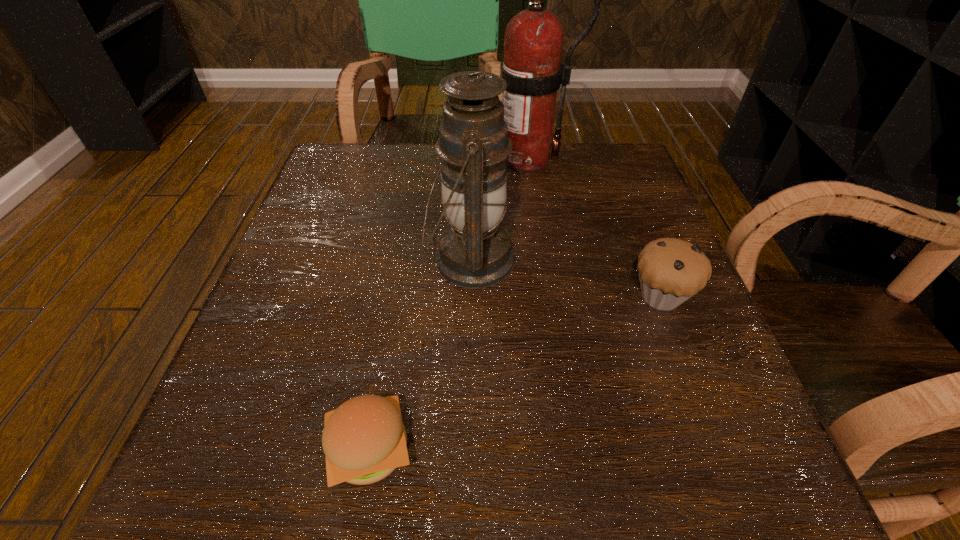
At what (x,y) coordinates should I click in order to perform the action: click on the farthest object. Please return your answer as a coordinate pair (x, y). The height and width of the screenshot is (540, 960). Looking at the image, I should click on (531, 66).

Locate an element on the screen. This screenshot has width=960, height=540. fire extinguisher is located at coordinates (531, 66).

This screenshot has height=540, width=960. I want to click on the second tallest object, so click(474, 252).

At what (x,y) coordinates should I click in order to perform the action: click on the rightmost object. Please return your answer as a coordinate pair (x, y). Looking at the image, I should click on [671, 270].

This screenshot has height=540, width=960. What are the coordinates of `muffin` in the screenshot? It's located at (671, 270).

I want to click on the shortest object, so pyautogui.click(x=364, y=440).

At what (x,y) coordinates should I click in order to perform the action: click on the nearest object. Please return your answer as a coordinate pair (x, y). This screenshot has width=960, height=540. Looking at the image, I should click on (364, 440).

Locate an element on the screen. free location located 0.260m at the nozzle of the fire extinguisher is located at coordinates (367, 158).

Identify the location of free region located at the nozzle of the fire extinguisher. The width and height of the screenshot is (960, 540). (430, 158).

What are the coordinates of `vacant area located 0.120m at the nozzle of the fire extinguisher` in the screenshot? It's located at (425, 158).